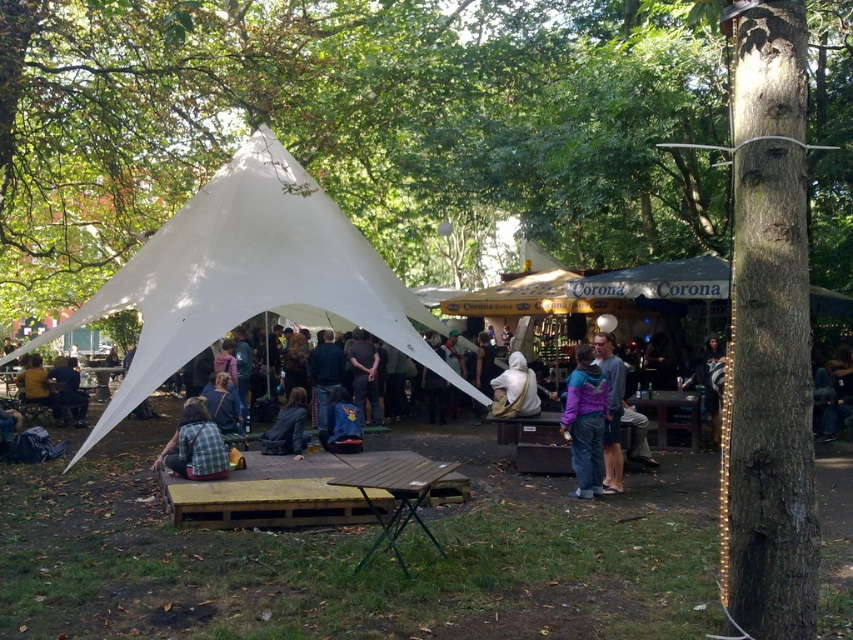
You are at the Corona kiosk and see two fabric bags hanging on the same rack. The white fabric bag at center and the blue fabric bag at center. Which bag has a smaller width?

The white fabric bag at center has a smaller width than the blue fabric bag at center according to the description.

From the picture: You are a photographer positioned behind the large white tent at the outdoor gathering. You want to take a photo that includes both the gray sweater at center and the plaid fabric shirt at center. Which of these items will appear larger in your photo?

The gray sweater at center will appear larger in the photo because it is closer to the viewer than the plaid fabric shirt at center.